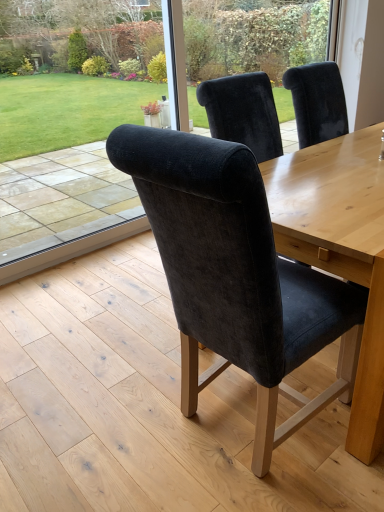
Where is `blank area beneath velvet chair back at center (from a real-world perspective)`? The height and width of the screenshot is (512, 384). blank area beneath velvet chair back at center (from a real-world perspective) is located at coordinates (86, 254).